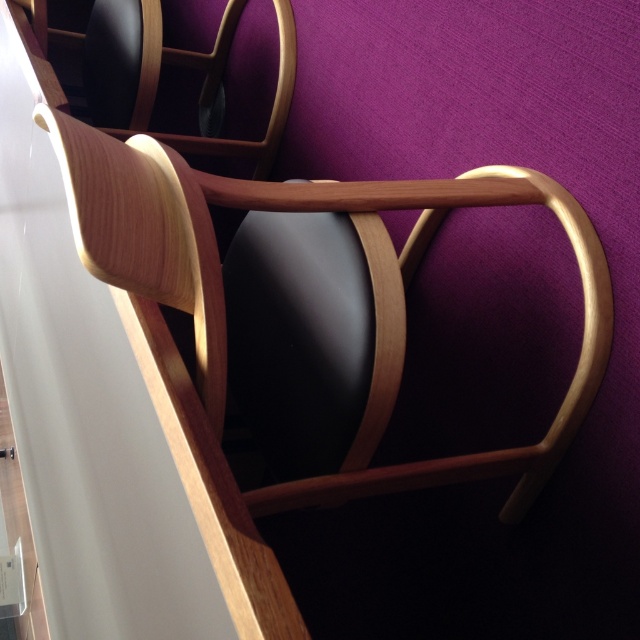
Question: Does white glossy table at left appear on the right side of wooden armchair at center?

Choices:
 (A) no
 (B) yes

Answer: (A)

Question: Which point is closer to the camera?

Choices:
 (A) (140, 547)
 (B) (186, 196)

Answer: (A)

Question: In this image, where is white glossy table at left located relative to wooden armchair at center?

Choices:
 (A) left
 (B) right

Answer: (A)

Question: Does white glossy table at left appear on the right side of wooden armchair at center?

Choices:
 (A) yes
 (B) no

Answer: (B)